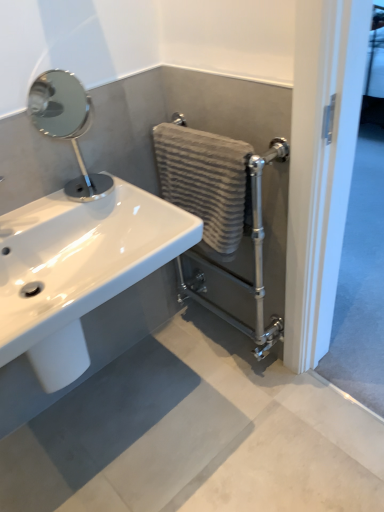
Question: Considering the relative positions of matte gray concrete at lower center and textured beige towel at center-right in the image provided, is matte gray concrete at lower center to the left of textured beige towel at center-right from the viewer's perspective?

Choices:
 (A) yes
 (B) no

Answer: (A)

Question: Considering the relative sizes of matte gray concrete at lower center and textured beige towel at center-right in the image provided, is matte gray concrete at lower center wider than textured beige towel at center-right?

Choices:
 (A) yes
 (B) no

Answer: (A)

Question: Is matte gray concrete at lower center not close to textured beige towel at center-right?

Choices:
 (A) yes
 (B) no

Answer: (B)

Question: Is matte gray concrete at lower center taller than textured beige towel at center-right?

Choices:
 (A) yes
 (B) no

Answer: (B)

Question: Is matte gray concrete at lower center completely or partially outside of textured beige towel at center-right?

Choices:
 (A) no
 (B) yes

Answer: (B)

Question: Relative to textured beige towel at center-right, is white glossy sink at lower left in front or behind?

Choices:
 (A) front
 (B) behind

Answer: (A)

Question: From a real-world perspective, is white glossy sink at lower left above or below textured beige towel at center-right?

Choices:
 (A) below
 (B) above

Answer: (B)

Question: From the image's perspective, relative to textured beige towel at center-right, is white glossy sink at lower left above or below?

Choices:
 (A) above
 (B) below

Answer: (B)

Question: Considering the relative positions of white glossy sink at lower left and textured beige towel at center-right in the image provided, is white glossy sink at lower left to the left or to the right of textured beige towel at center-right?

Choices:
 (A) right
 (B) left

Answer: (B)

Question: Does point (82, 97) appear closer or farther from the camera than point (216, 396)?

Choices:
 (A) farther
 (B) closer

Answer: (A)

Question: From the image's perspective, is polished chrome mirror at upper left located above or below matte gray concrete at lower center?

Choices:
 (A) below
 (B) above

Answer: (B)

Question: Is polished chrome mirror at upper left to the left or to the right of matte gray concrete at lower center in the image?

Choices:
 (A) right
 (B) left

Answer: (B)

Question: In the image, is polished chrome mirror at upper left positioned in front of or behind matte gray concrete at lower center?

Choices:
 (A) behind
 (B) front

Answer: (A)

Question: Is textured beige towel at center-right inside or outside of matte gray concrete at lower center?

Choices:
 (A) inside
 (B) outside

Answer: (B)

Question: Based on their sizes in the image, would you say textured beige towel at center-right is bigger or smaller than matte gray concrete at lower center?

Choices:
 (A) small
 (B) big

Answer: (A)